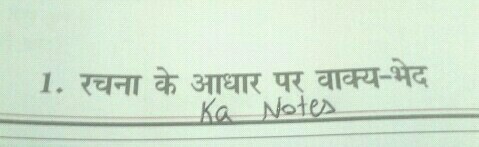
The height and width of the screenshot is (147, 479). Identify the location of hook. (159, 66), (400, 65).